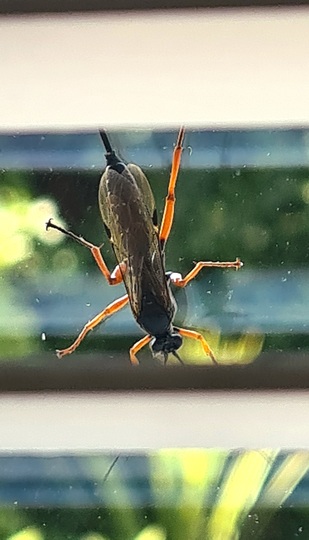
Find the location of a particular element. Image resolution: width=309 pixels, height=540 pixels. plant is located at coordinates (237, 508).